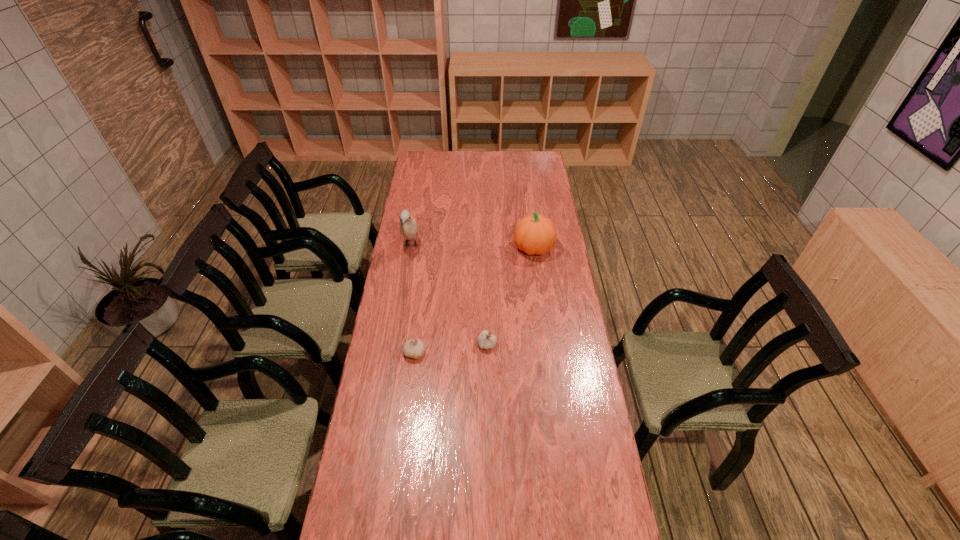
At what (x,y) coordinates should I click in order to perform the action: click on bird. Please return your answer as a coordinate pair (x, y). The image size is (960, 540). Looking at the image, I should click on (408, 227).

Locate an element on the screen. This screenshot has height=540, width=960. the rightmost object is located at coordinates (535, 234).

Find the location of a particular element. The height and width of the screenshot is (540, 960). the taller garlic is located at coordinates (485, 340).

Where is `the third tallest object`? This screenshot has height=540, width=960. the third tallest object is located at coordinates (485, 340).

The image size is (960, 540). Identify the location of the shortest object. [x=414, y=348].

You are a GUI agent. You are given a task and a screenshot of the screen. Output one action in this format:
    pyautogui.click(x=<x>, y=<y>)
    Task: Click on the third object from right to left
    This screenshot has width=960, height=540.
    Given the screenshot: What is the action you would take?
    pyautogui.click(x=414, y=348)

At what (x,y) coordinates should I click in order to perform the action: click on free region located 0.360m at the beak of the bird. Please return your answer as a coordinate pair (x, y). The width and height of the screenshot is (960, 540). Looking at the image, I should click on (398, 322).

What are the coordinates of `vacant position located on the left of the pumpkin` in the screenshot? It's located at (488, 248).

Find the location of `free space located 0.230m on the left of the right garlic`. free space located 0.230m on the left of the right garlic is located at coordinates (417, 344).

At what (x,y) coordinates should I click in order to perform the action: click on vacant position located 0.190m on the right of the third object from right to left. Please return your answer as a coordinate pair (x, y). The height and width of the screenshot is (540, 960). Looking at the image, I should click on (476, 353).